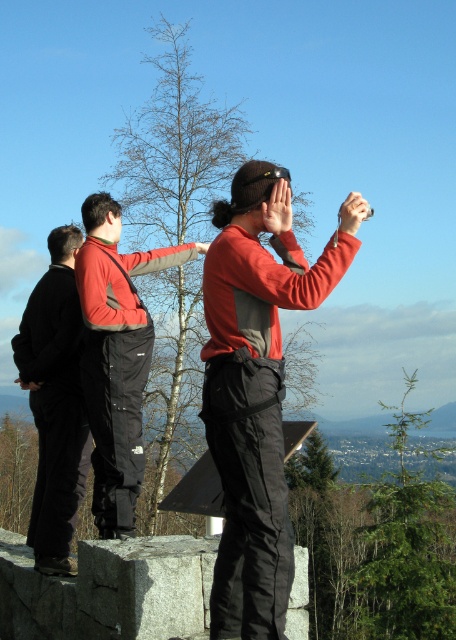
You are a photographer trying to capture a group photo of the matte red jacket at center and the red fleece jacket at center. Since you want both subjects to appear in the frame equally, which jacket should you adjust the camera angle to focus on more?

The matte red jacket at center is much taller than the red fleece jacket at center, so you should focus the camera angle more on the red fleece jacket at center to balance their sizes in the photo.

You are a photographer trying to capture a group photo of the matte red jacket at center and the red fleece jacket at center. Since you want to frame them properly, which jacket should be on the left side of the photo?

The red fleece jacket at center should be on the left side of the photo because the matte red jacket at center is positioned on the right side of it.

You are planning to take a photo of the two people wearing the matte red jacket at center and the black softshell jacket at left. Based on their positions, which one will appear larger in the photo?

The matte red jacket at center will appear larger in the photo because it is positioned closer to the camera compared to the black softshell jacket at left, which is further away.